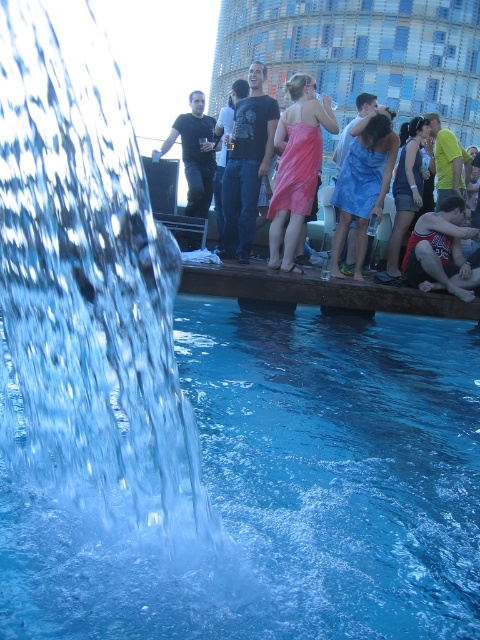
Question: Can you confirm if pink satin dress at center is wider than reddish-brown fabric shorts at lower right?

Choices:
 (A) no
 (B) yes

Answer: (B)

Question: Is reddish-brown fabric shorts at lower right behind matte black shirt at upper center?

Choices:
 (A) yes
 (B) no

Answer: (B)

Question: Estimate the real-world distances between objects in this image. Which object is farther from the matte black dress at center?

Choices:
 (A) matte black shirt at upper center
 (B) reddish-brown fabric shorts at lower right
 (C) black t-shirt at center

Answer: (A)

Question: Which object appears closest to the camera in this image?

Choices:
 (A) blue satin dress at center
 (B) reddish-brown fabric shorts at lower right

Answer: (B)

Question: Among these objects, which one is farthest from the camera?

Choices:
 (A) blue satin dress at center
 (B) matte black shirt at upper center

Answer: (B)

Question: Is pink satin dress at center to the right of matte black shirt at upper center from the viewer's perspective?

Choices:
 (A) yes
 (B) no

Answer: (A)